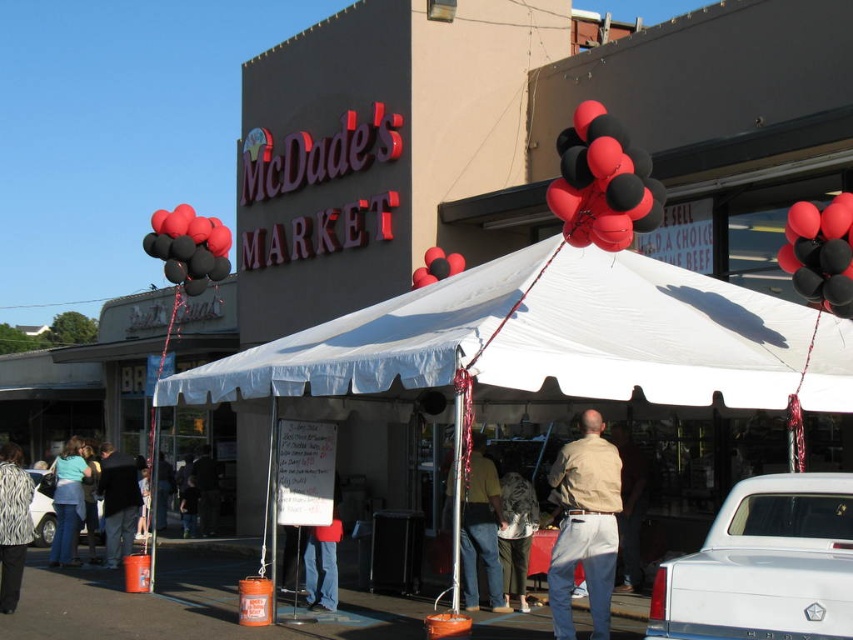
You are standing at the entrance of McDade Market and see two points marked on the ground. One is at point (755, 554) and the other at point (824, 211). Which point is closer to the entrance?

Point (755, 554) is in front of point (824, 211), so it is closer to the entrance.

You are helping set up a booth at McDade Market and need to place a 3ft wide banner between the dark gray fabric jacket at center and the light blue denim jeans at lower left. Can the banner fit between them based on their widths?

The dark gray fabric jacket at center is wider than the light blue denim jeans at lower left. Since the banner is 3ft wide, it depends on the actual width of the jacket and jeans. However, the description only states the jacket is wider, not the exact measurements. Therefore, we cannot confirm if the banner will fit without more specific width details.